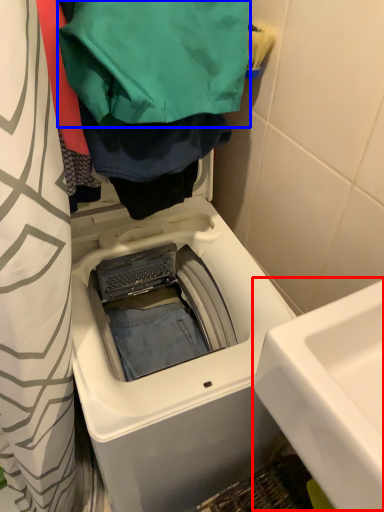
Question: Which of the following is the closest to the observer, sink (highlighted by a red box) or clothing (highlighted by a blue box)?

Choices:
 (A) sink
 (B) clothing

Answer: (A)